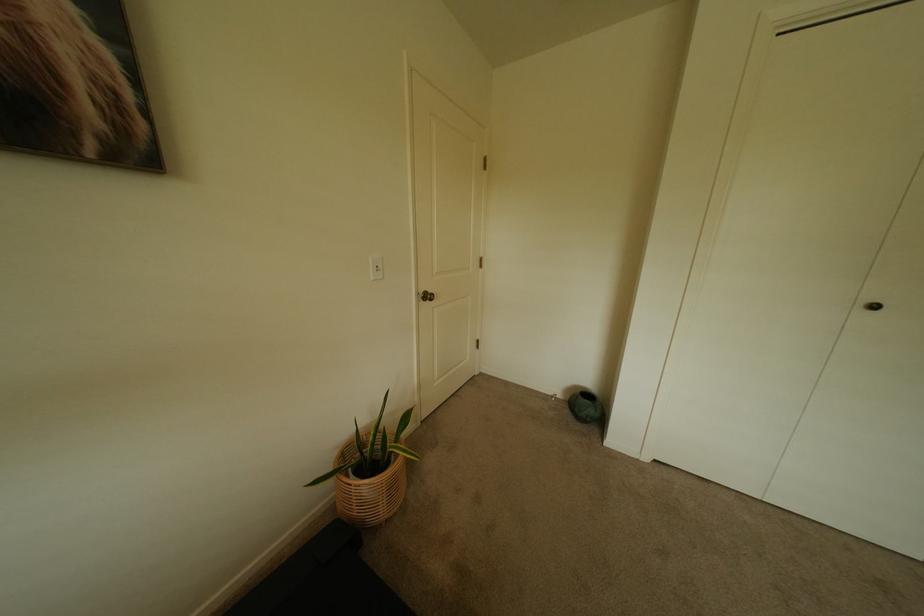
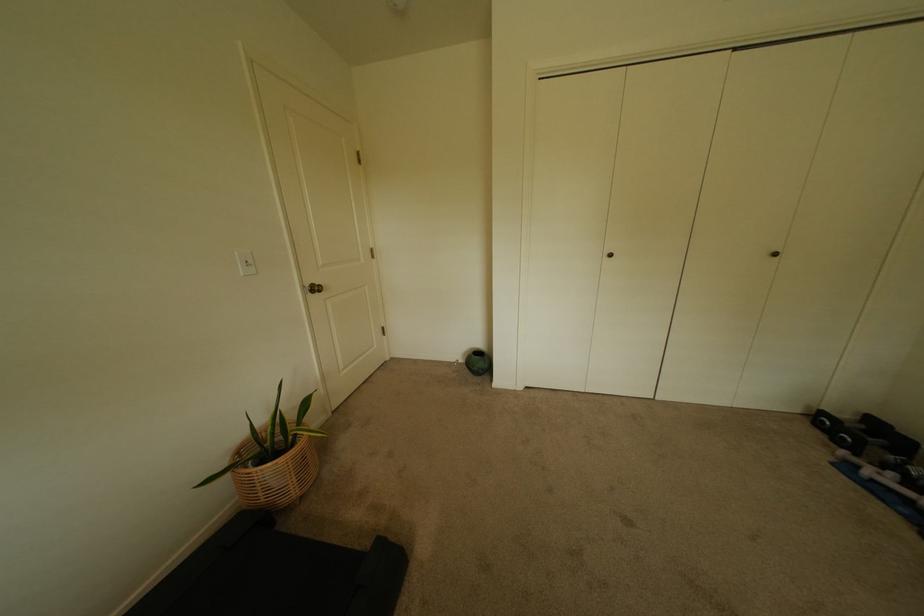
Find the pixel in the second image that matches (430,293) in the first image.

(315, 286)